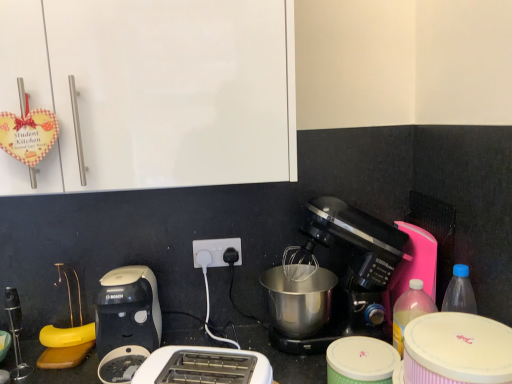
Identify the location of blank space above white plastic toaster at lower center, the 2th toaster positioned from the left (from a real-world perspective). (188, 355).